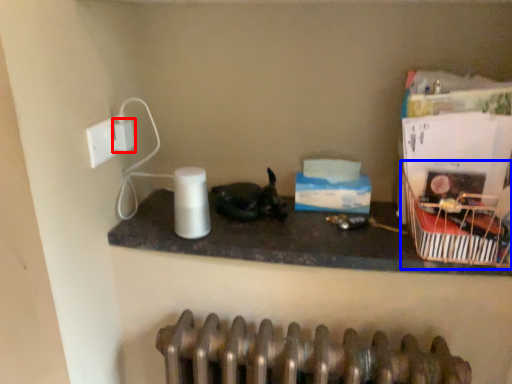
Question: Among these objects, which one is nearest to the camera, electric outlet (highlighted by a red box) or basket (highlighted by a blue box)?

Choices:
 (A) electric outlet
 (B) basket

Answer: (B)